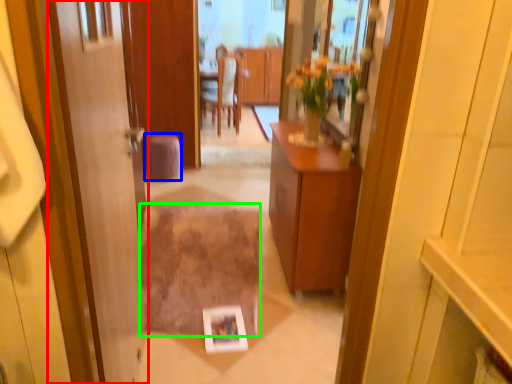
Question: Which object is positioned closest to door (highlighted by a red box)? Select from stool (highlighted by a blue box) and plain (highlighted by a green box).

Choices:
 (A) stool
 (B) plain

Answer: (B)